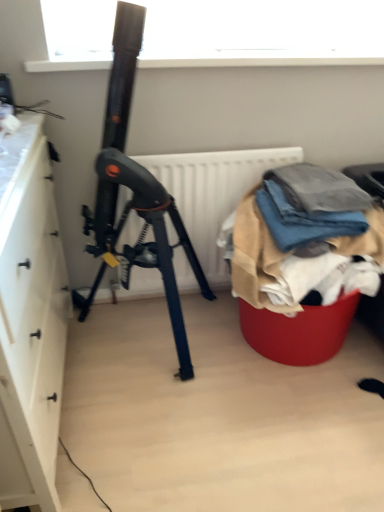
Question: Is the depth of denim fabric at right less than that of white matte cabinet at left?

Choices:
 (A) no
 (B) yes

Answer: (A)

Question: Considering the relative sizes of denim fabric at right and white matte cabinet at left in the image provided, is denim fabric at right smaller than white matte cabinet at left?

Choices:
 (A) no
 (B) yes

Answer: (B)

Question: Is denim fabric at right located outside white matte cabinet at left?

Choices:
 (A) no
 (B) yes

Answer: (B)

Question: Does denim fabric at right have a greater width compared to white matte cabinet at left?

Choices:
 (A) yes
 (B) no

Answer: (B)

Question: From a real-world perspective, is denim fabric at right physically above white matte cabinet at left?

Choices:
 (A) yes
 (B) no

Answer: (A)

Question: Is denim fabric at right aimed at white matte cabinet at left?

Choices:
 (A) no
 (B) yes

Answer: (A)

Question: Is white matte radiator at center at the back of white matte cabinet at left?

Choices:
 (A) no
 (B) yes

Answer: (A)

Question: Are white matte cabinet at left and white matte radiator at center making contact?

Choices:
 (A) yes
 (B) no

Answer: (B)

Question: Does white matte cabinet at left have a greater width compared to white matte radiator at center?

Choices:
 (A) yes
 (B) no

Answer: (A)

Question: From the image's perspective, would you say white matte cabinet at left is positioned over white matte radiator at center?

Choices:
 (A) yes
 (B) no

Answer: (B)

Question: Considering the relative sizes of white matte cabinet at left and white matte radiator at center in the image provided, is white matte cabinet at left smaller than white matte radiator at center?

Choices:
 (A) no
 (B) yes

Answer: (A)

Question: Is white matte cabinet at left at the right side of white matte radiator at center?

Choices:
 (A) no
 (B) yes

Answer: (A)

Question: From the image's perspective, is white matte radiator at center under white matte cabinet at left?

Choices:
 (A) yes
 (B) no

Answer: (B)